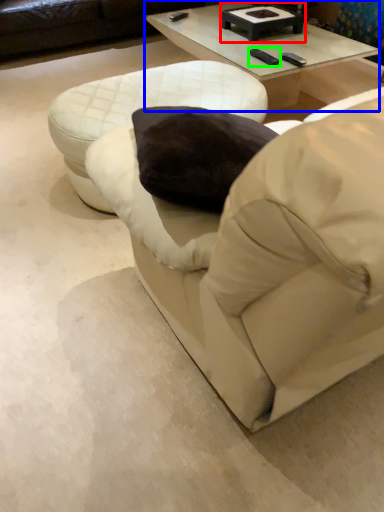
Question: Which object is positioned closest to round table (highlighted by a red box)? Select from coffee table (highlighted by a blue box) and pad (highlighted by a green box).

Choices:
 (A) coffee table
 (B) pad

Answer: (A)